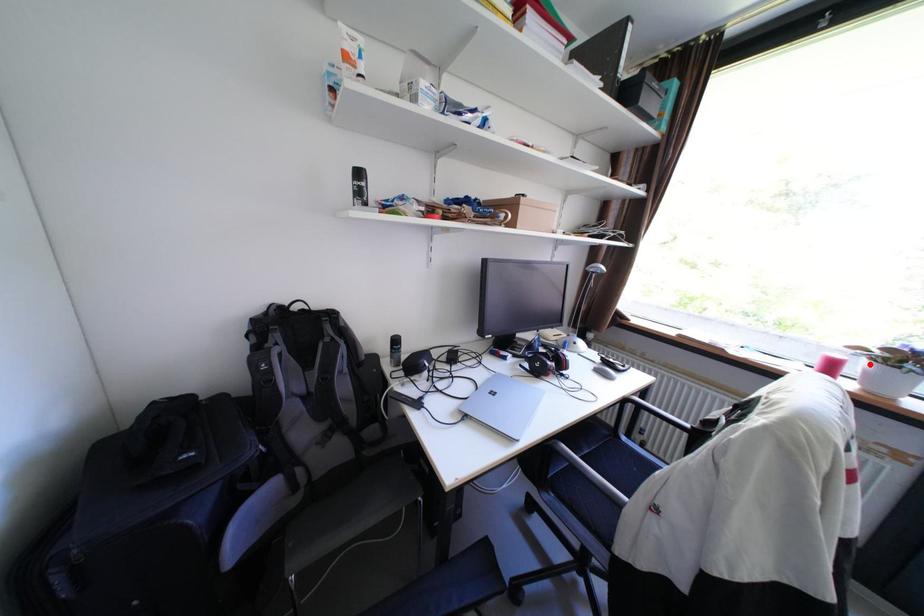
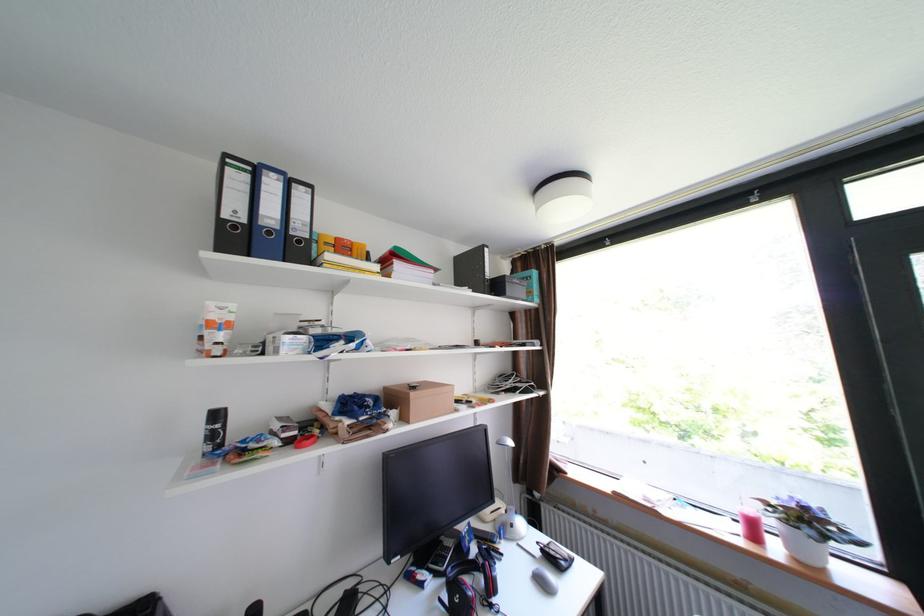
Locate, in the second image, the point that corresponds to the highlighted location in the first image.

(782, 523)